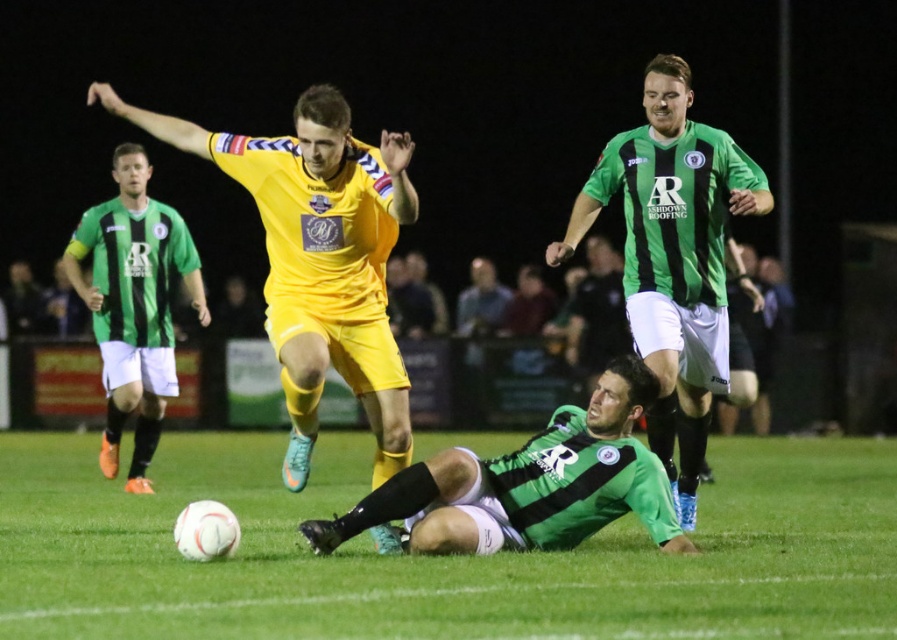
You are a soccer referee observing the field. You notice the green grass at center and the green striped jersey at left. Which of these two items takes up more space in the image?

The green grass at center takes up more space in the image compared to the green striped jersey at left because it has a larger size.